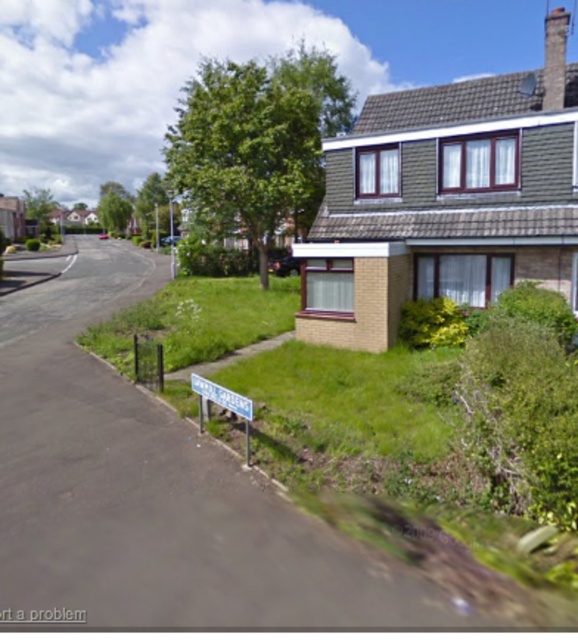
You are a delivery person approaching the suburban street scene. You need to read the blue plastic street sign at lower center and the white plastic street sign at lower center. Which sign is positioned lower in the image?

The blue plastic street sign at lower center is positioned below the white plastic street sign at lower center, so the blue one is lower.

You are a delivery driver who needs to read both street signs on the suburban road. The distance between your truck and the blue plastic street sign at lower center is 10 meters. Can you read the white plastic street sign at lower center from your current position?

The blue plastic street sign at lower center is 12.14 centimeters away from white plastic street sign at lower center. Since the distance between your truck and the blue plastic street sign at lower center is 10 meters, you are 10 meters away from the blue sign, which is much farther than the 12.14 centimeters between the two signs. Therefore, you can read the white plastic street sign at lower center from your current position because it is very close to the blue one.